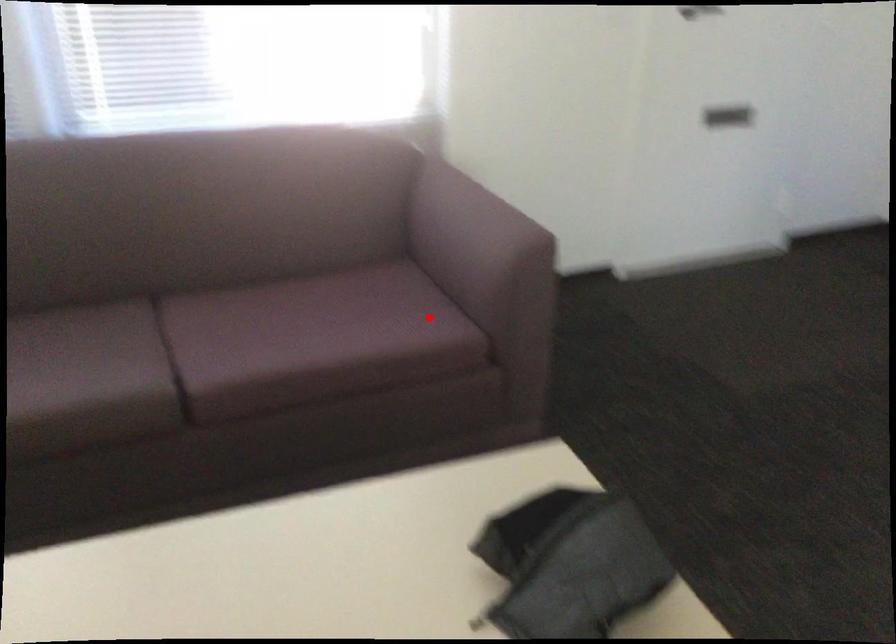
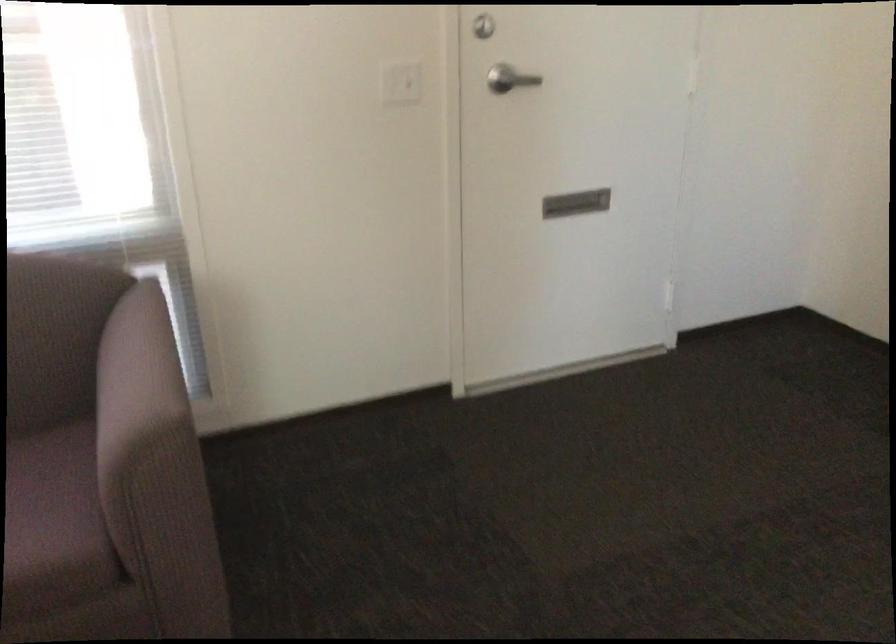
The point at the highlighted location is marked in the first image. Where is the corresponding point in the second image?

(53, 520)